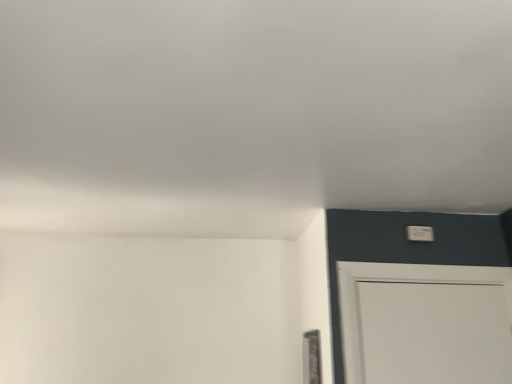
Question: Is white plastic light switch at upper right inside or outside of clear glass window at lower right?

Choices:
 (A) inside
 (B) outside

Answer: (B)

Question: From a real-world perspective, is white plastic light switch at upper right physically located above or below clear glass window at lower right?

Choices:
 (A) above
 (B) below

Answer: (A)

Question: In terms of width, does white plastic light switch at upper right look wider or thinner when compared to clear glass window at lower right?

Choices:
 (A) thin
 (B) wide

Answer: (B)

Question: From their relative heights in the image, would you say clear glass window at lower right is taller or shorter than white plastic light switch at upper right?

Choices:
 (A) tall
 (B) short

Answer: (A)

Question: From a real-world perspective, is clear glass window at lower right positioned above or below white plastic light switch at upper right?

Choices:
 (A) below
 (B) above

Answer: (A)

Question: Does point (318, 352) appear closer or farther from the camera than point (426, 233)?

Choices:
 (A) farther
 (B) closer

Answer: (B)

Question: Based on their positions, is clear glass window at lower right located to the left or right of white plastic light switch at upper right?

Choices:
 (A) right
 (B) left

Answer: (B)